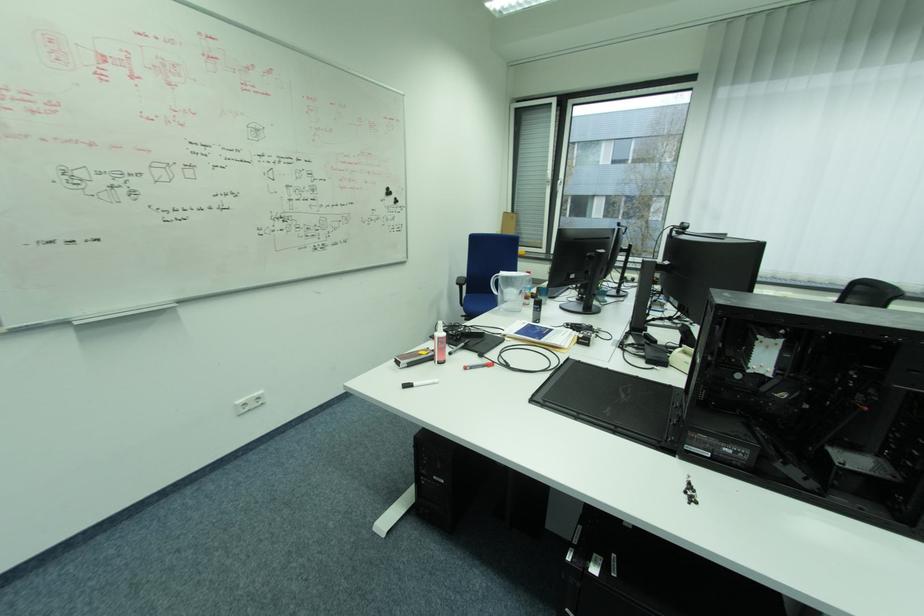
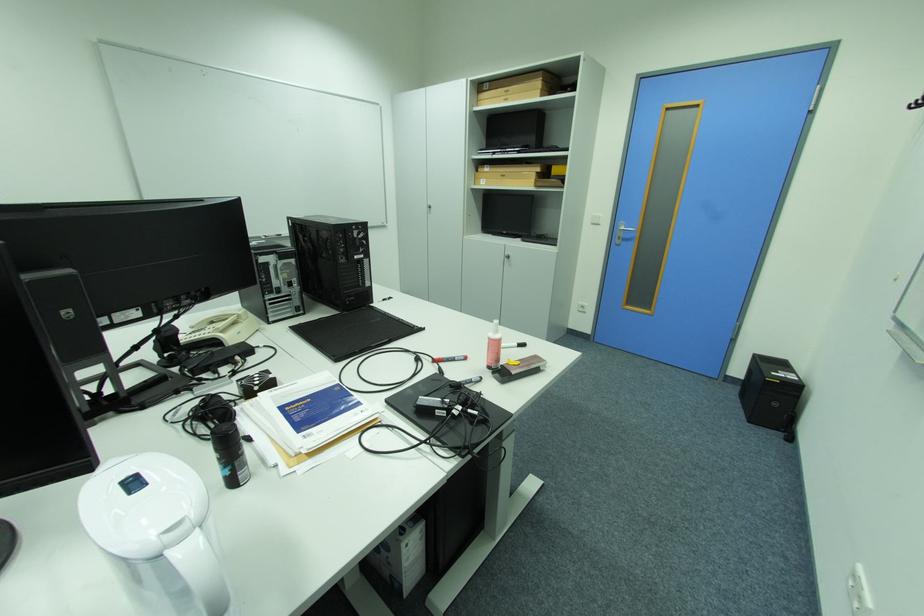
Question: I am providing you with two images of the same scene from different viewpoints. Which of the following objects are not visible in image2?

Choices:
 (A) white pitcher handle
 (B) white chalk eraser
 (C) white marker
 (D) cardboard box

Answer: (C)